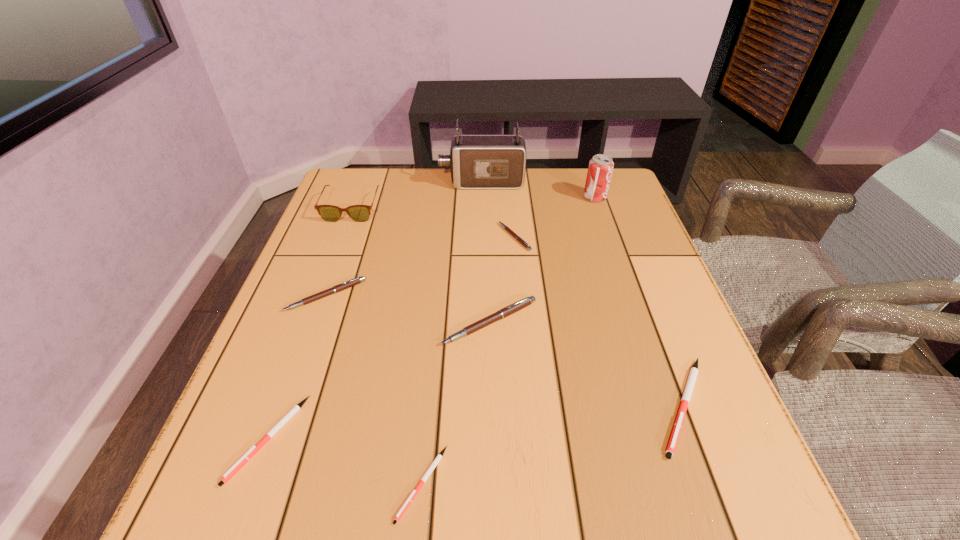
This screenshot has width=960, height=540. Identify the location of vacant point at the far left corner. tap(386, 200).

This screenshot has height=540, width=960. In order to click on vacant space at the near left corner in this screenshot , I will do `click(214, 508)`.

In the image, there is a desktop. Where is `vacant space at the far right corner`? The height and width of the screenshot is (540, 960). vacant space at the far right corner is located at coordinates (597, 204).

The image size is (960, 540). In the image, there is a desktop. Find the location of `vacant space at the near right corner`. vacant space at the near right corner is located at coordinates (698, 512).

The image size is (960, 540). What are the coordinates of `free space between the leftmost pink pen and the second smallest white pen` in the screenshot? It's located at (297, 367).

Locate an element on the screen. The image size is (960, 540). free space between the second smallest pink pen and the camcorder is located at coordinates (404, 239).

The image size is (960, 540). I want to click on vacant space that is in between the biggest pink pen and the seventh shortest object, so click(x=420, y=265).

Identify the location of blank region between the leftmost pink pen and the tallest pen. The height and width of the screenshot is (540, 960). (408, 309).

Image resolution: width=960 pixels, height=540 pixels. What are the coordinates of `vacant region between the shortest pen and the leftmost white pen` in the screenshot? It's located at (345, 461).

You are a GUI agent. You are given a task and a screenshot of the screen. Output one action in this format:
    pyautogui.click(x=<x>, y=<y>)
    Task: Click on the vacant space in between the biggest white pen and the leftmost white pen
    
    Given the screenshot: What is the action you would take?
    pyautogui.click(x=475, y=422)